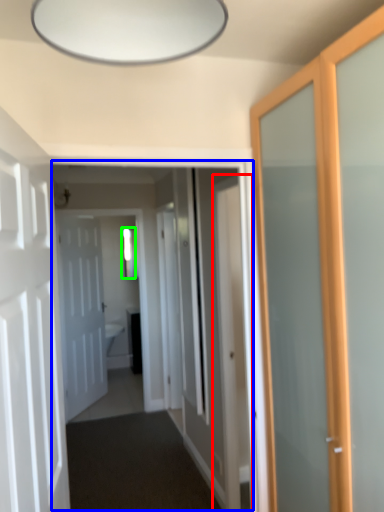
Question: Estimate the real-world distances between objects in this image. Which object is closer to door (highlighted by a red box), corridor (highlighted by a blue box) or window (highlighted by a green box)?

Choices:
 (A) corridor
 (B) window

Answer: (A)